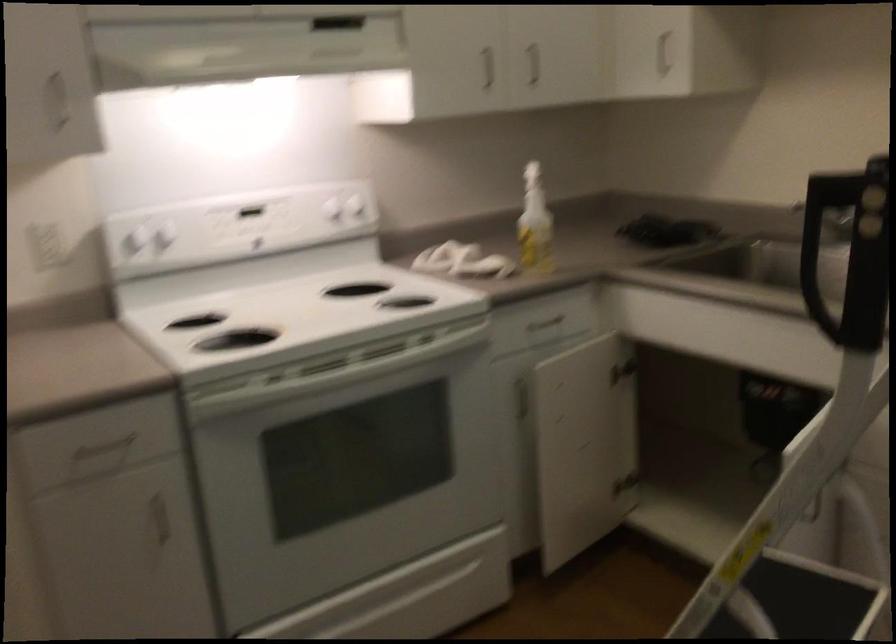
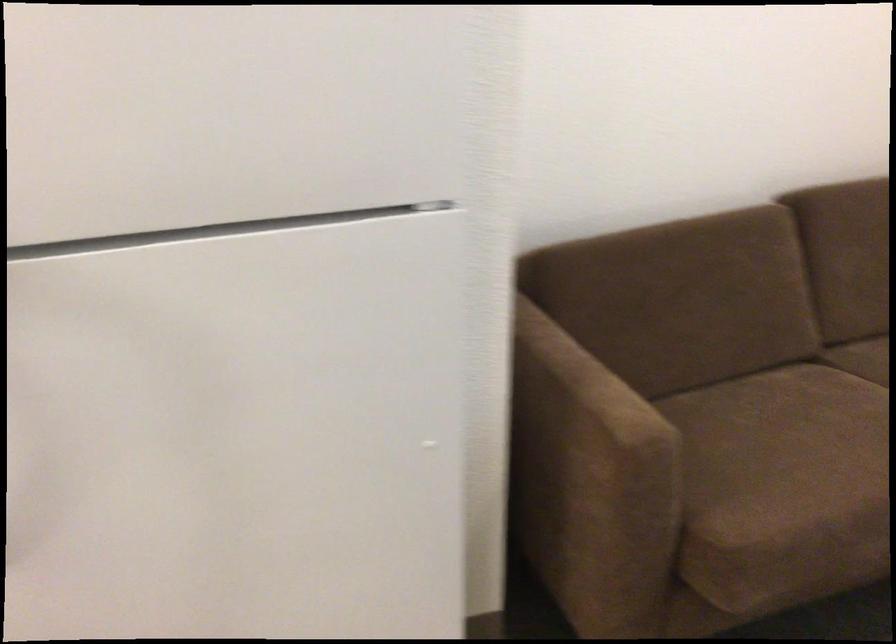
Based on the continuous images, in which direction is the camera rotating?

The camera's rotation is toward right-down.